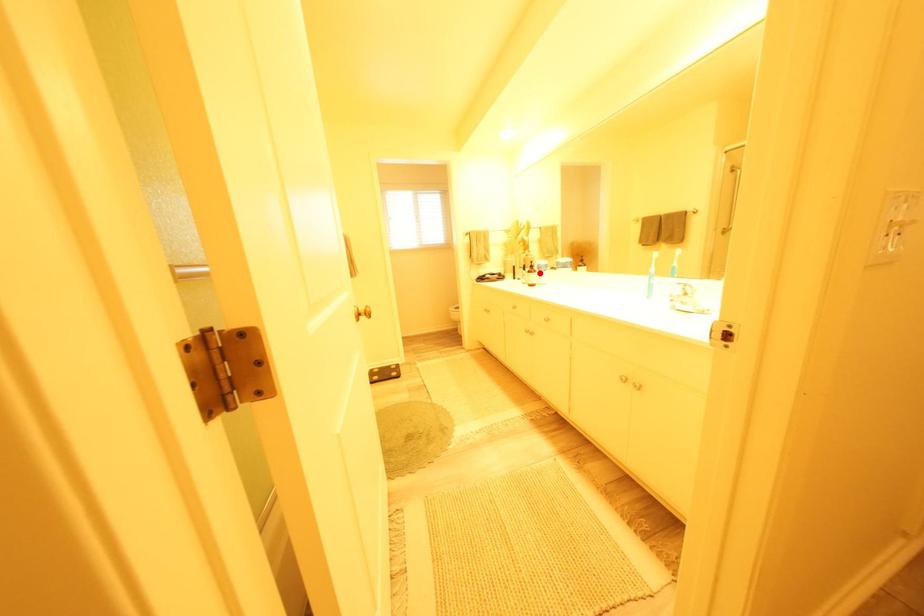
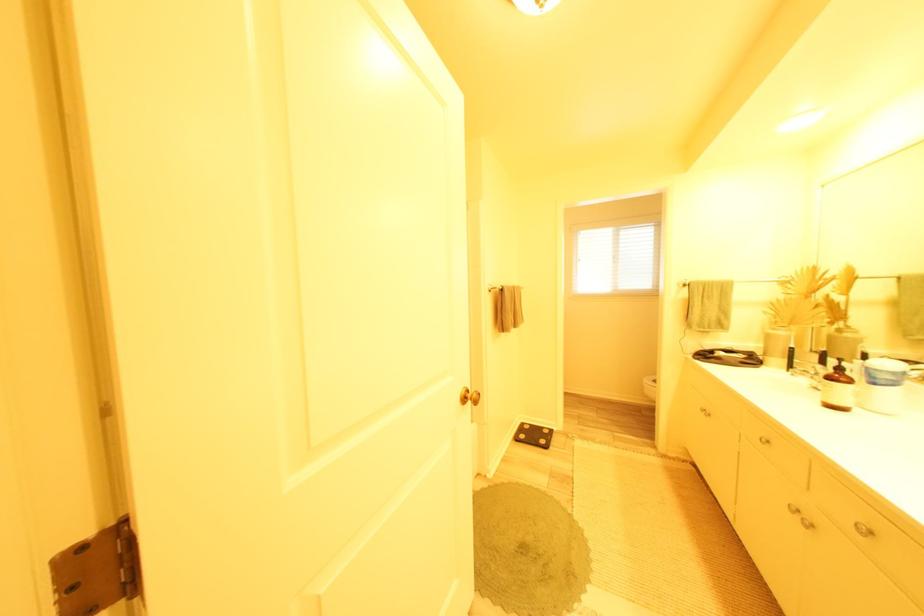
In the second image, find the point that corresponds to the highlighted location in the first image.

(841, 379)